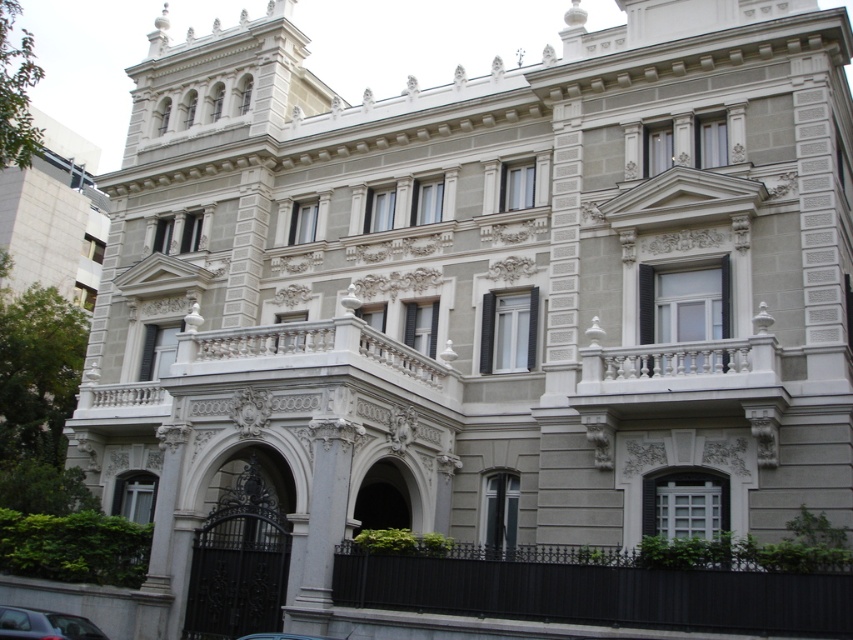
You are a delivery driver who needs to park your van between the metallic blue car at lower left and the metallic silver car at center. Your van is 6 meters long. Can you fit your van between them?

The distance between the metallic blue car at lower left and the metallic silver car at center is 7.77 meters. Since your van is 6 meters long, there is enough space to park it between them.

You are standing at the base of the grand building and want to take a photo of the point at coordinate point (90, 632). Your camera has a maximum focus range of 40 meters. Will you be able to capture the point clearly in your photo?

The point at coordinate point (90, 632) is 41.69 meters away from the camera, which exceeds the maximum focus range of 40 meters. Therefore, you will not be able to capture the point clearly in your photo.

You are a delivery person trying to park your vehicle in the parking lot near the grand building. You have two cars available, the metallic blue car at lower left and the metallic silver car at center. Which car should you choose if you need to fit into a narrow parking spot that can only accommodate a car with a width of 1.8 meters?

The metallic blue car at lower left has a lesser width compared to the metallic silver car at center, so you should choose the metallic blue car at lower left to fit into the narrow parking spot.